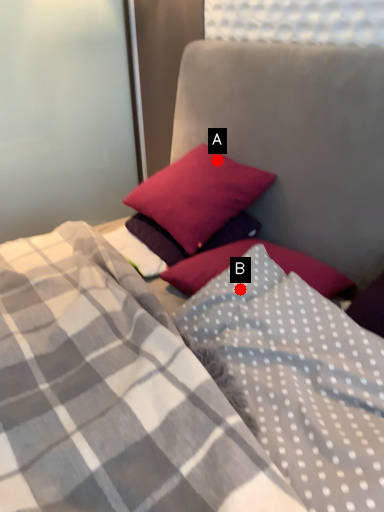
Question: Two points are circled on the image, labeled by A and B beside each circle. Among these points, which one is nearest to the camera?

Choices:
 (A) A is closer
 (B) B is closer

Answer: (B)